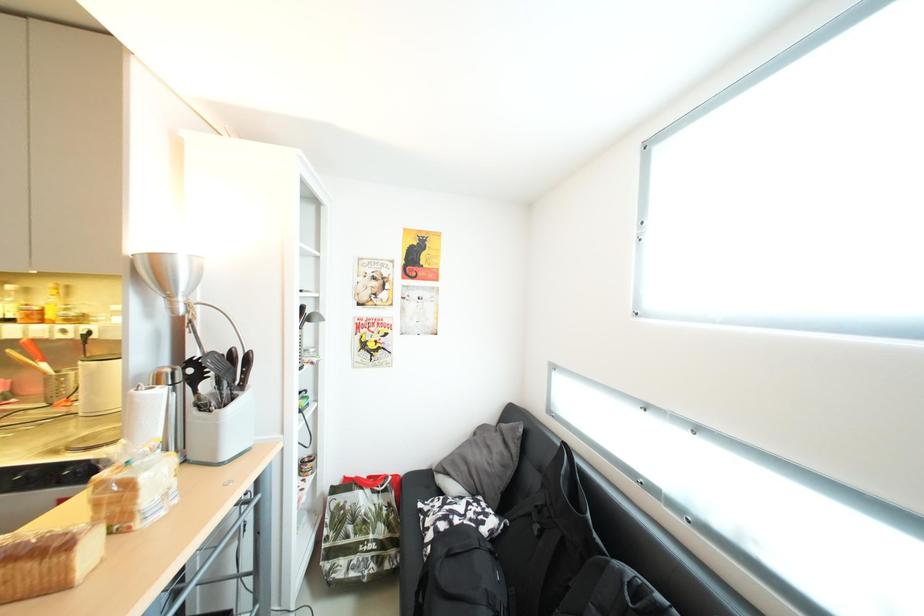
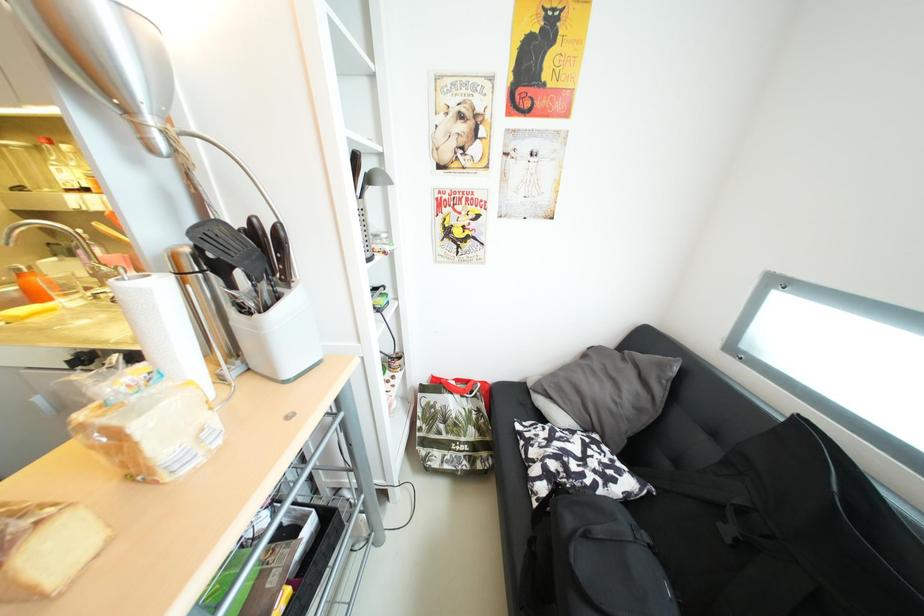
How did the camera likely rotate?

The camera's rotation is toward left-down.